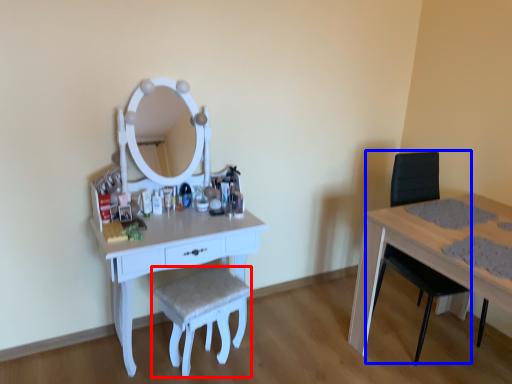
Question: Which object is closer to the camera taking this photo, stool (highlighted by a red box) or swivel chair (highlighted by a blue box)?

Choices:
 (A) stool
 (B) swivel chair

Answer: (A)